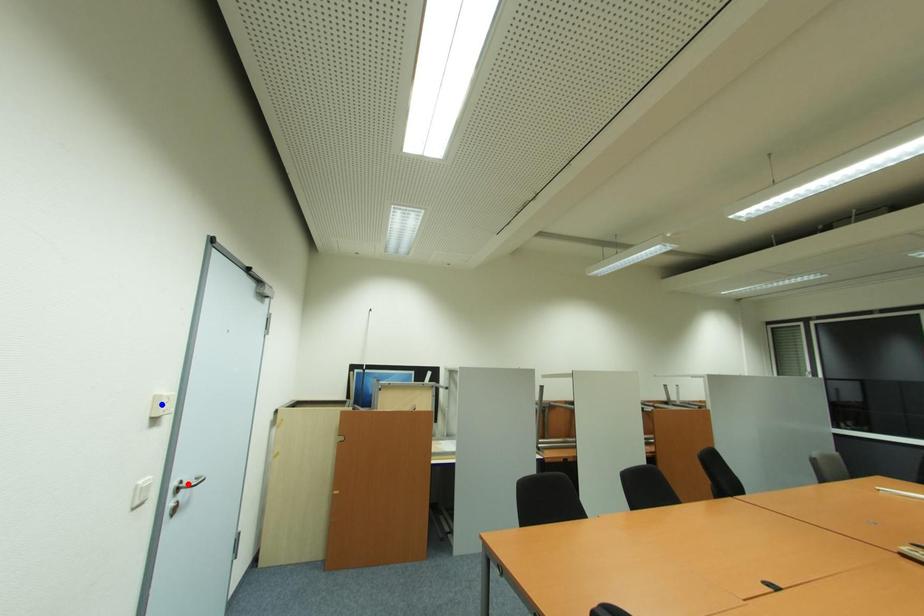
Question: Which of the two points in the image is closer to the camera?

Choices:
 (A) Blue point is closer.
 (B) Red point is closer.

Answer: (A)